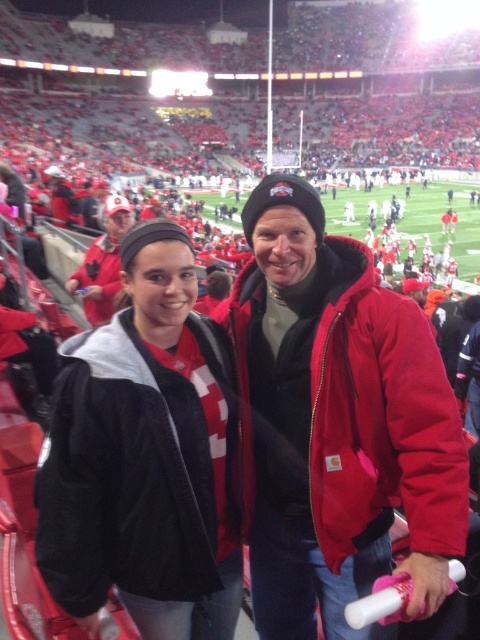
Can you confirm if red carhartt jacket at center is positioned to the right of black fleece jacket at center?

Indeed, red carhartt jacket at center is positioned on the right side of black fleece jacket at center.

Is red carhartt jacket at center smaller than black fleece jacket at center?

Actually, red carhartt jacket at center might be larger than black fleece jacket at center.

Locate an element on the screen. red carhartt jacket at center is located at coordinates (338, 422).

Is black fleece jacket at center thinner than matte red jacket at center?

Yes, black fleece jacket at center is thinner than matte red jacket at center.

Is black fleece jacket at center further to camera compared to matte red jacket at center?

No, black fleece jacket at center is in front of matte red jacket at center.

Identify the location of black fleece jacket at center. (145, 458).

This screenshot has height=640, width=480. Identify the location of black fleece jacket at center. click(145, 458).

Consider the image. Who is more distant from viewer, (363, 348) or (106, 273)?

The point (106, 273) is more distant.

Find the location of `red carhartt jacket at center`. red carhartt jacket at center is located at coordinates (338, 422).

At what (x,y) coordinates should I click in order to perform the action: click on red carhartt jacket at center. Please return your answer as a coordinate pair (x, y). The height and width of the screenshot is (640, 480). Looking at the image, I should click on (338, 422).